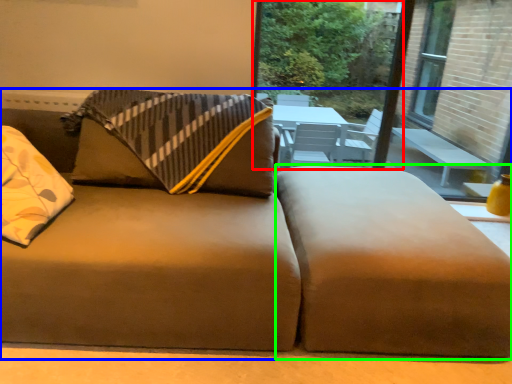
Question: Which object is the closest to the window screen (highlighted by a red box)? Choose among these: studio couch (highlighted by a blue box) or footrest (highlighted by a green box).

Choices:
 (A) studio couch
 (B) footrest

Answer: (A)